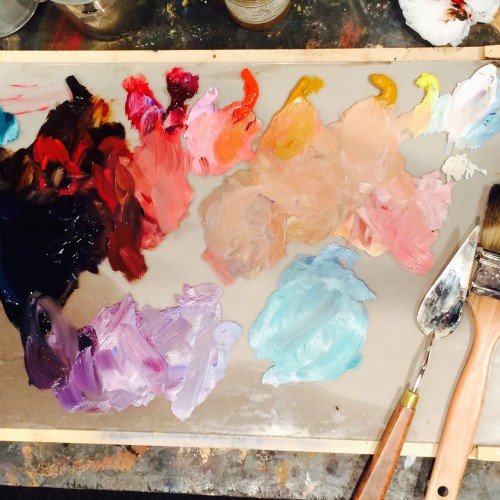
This screenshot has height=500, width=500. I want to click on cans of paint, so click(100, 29), click(264, 5).